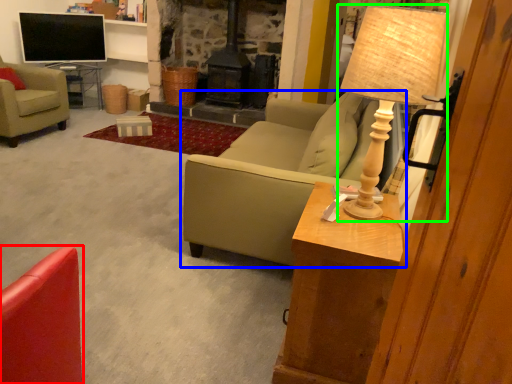
Question: Which object is the closest to the chair (highlighted by a red box)? Choose among these: studio couch (highlighted by a blue box) or table lamp (highlighted by a green box).

Choices:
 (A) studio couch
 (B) table lamp

Answer: (B)